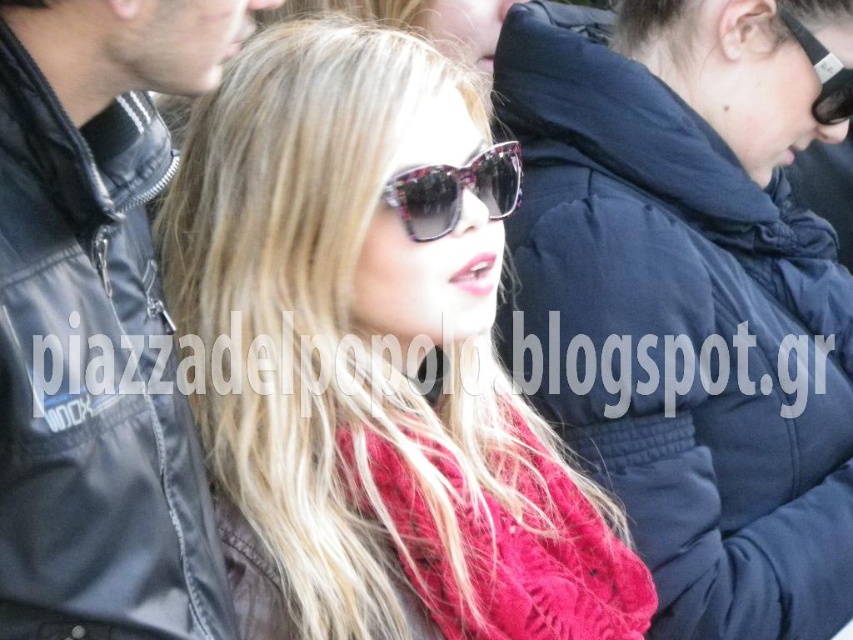
You are taking a photo of the person in the scene. The camera is focused on the point at (350,81). If you want to adjust the focus to the point at (363,490), will you need to move the camera lens forward or backward?

Since point (350,81) is closer to the camera than point (363,490), you will need to move the camera lens forward to focus on the farther point (363,490).

You are a photographer trying to capture the dark blue puffer jacket at upper right and the black plastic sunglasses at upper right in a single frame. Based on their positions, which object should you adjust your camera focus to first to ensure both are in the frame?

The dark blue puffer jacket at upper right is positioned on the left side of black plastic sunglasses at upper right. Since the jacket is to the left of the sunglasses, you should focus on the dark blue puffer jacket at upper right first to ensure both are included in the frame.